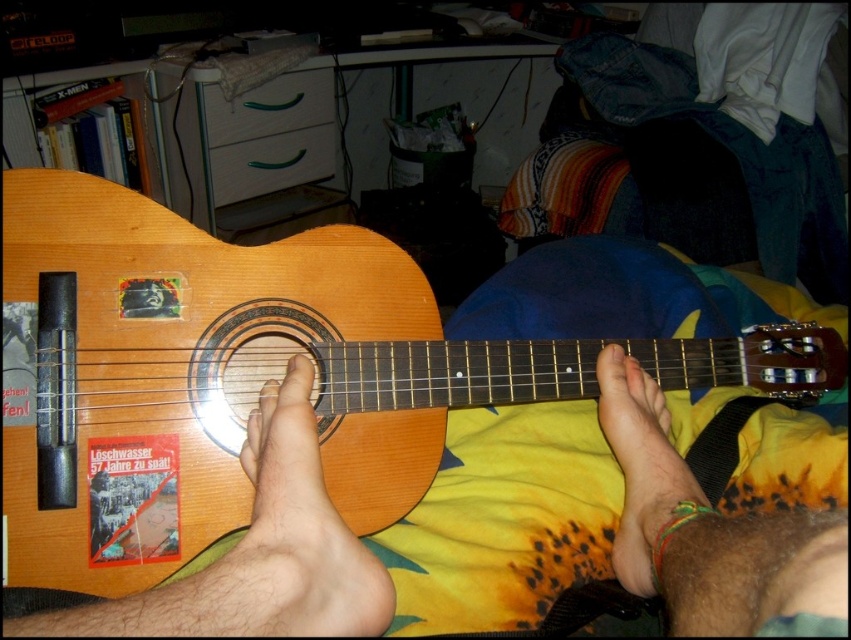
You are a photographer standing at a certain distance from the natural wood guitar at center. You want to take a close up shot of the guitar. Given that your camera requires the subject to be within 15 inches for optimal focus, is the current distance sufficient?

The distance between the natural wood guitar at center and the camera is 18.68 inches, which is greater than the 15 inches required for optimal focus. Therefore, the current distance is not sufficient for a close up shot.

You are a photographer trying to capture the natural wood guitar at center and the brown leather foot at lower right in a single frame. Given that the guitar is larger than the foot, how should you position your camera to ensure both objects are clearly visible?

Since the natural wood guitar at center is larger than the brown leather foot at lower right, position the camera closer to the brown leather foot at lower right to balance their sizes in the frame.

You are a photographer trying to capture the natural wood guitar at center and the brown leather foot at lower right in the same frame. Based on their positions, which object should you focus on first if you want to ensure both are in focus?

The natural wood guitar at center is located above the brown leather foot at lower right, so you should focus on the natural wood guitar at center first to ensure both are in focus since it is closer to the camera.